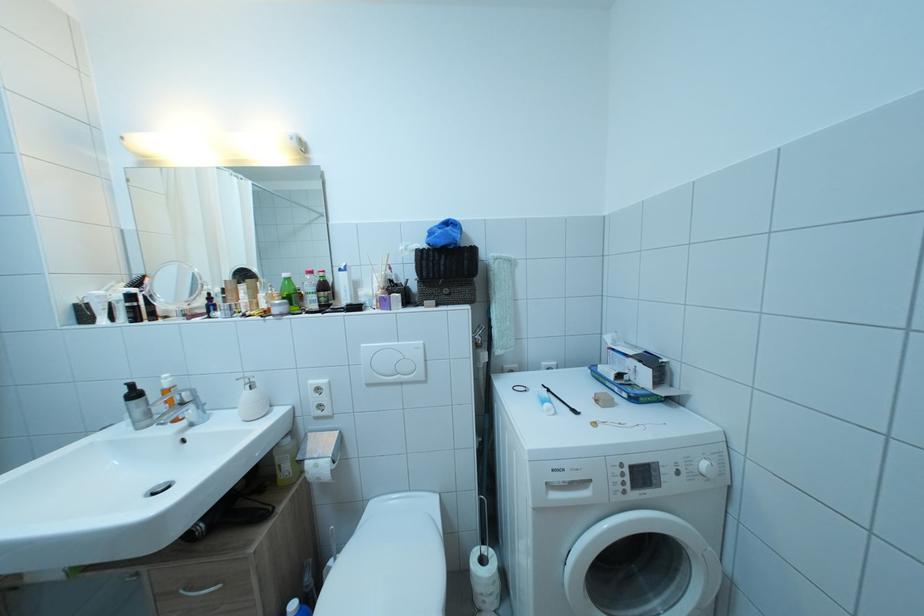
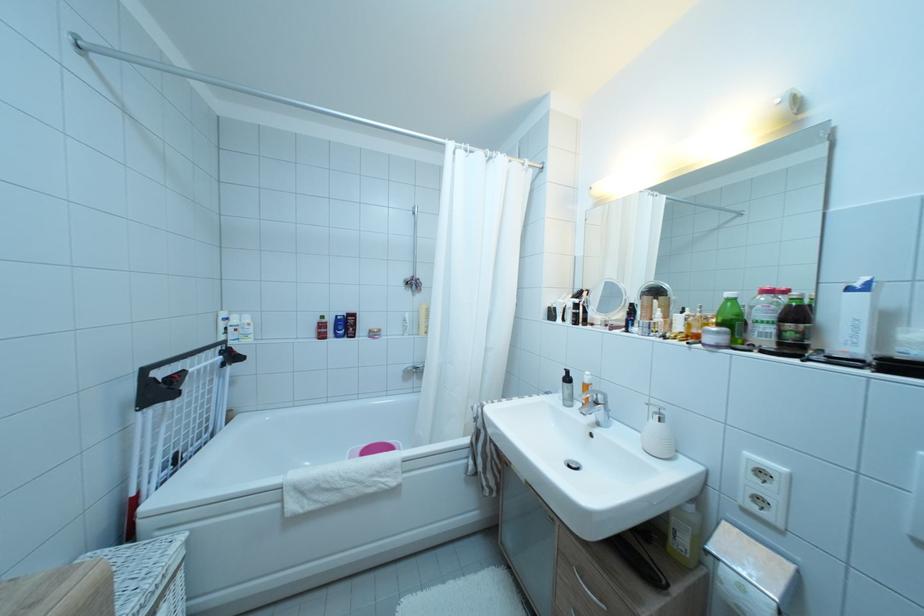
The point at (161, 400) is marked in the first image. Where is the corresponding point in the second image?

(585, 390)